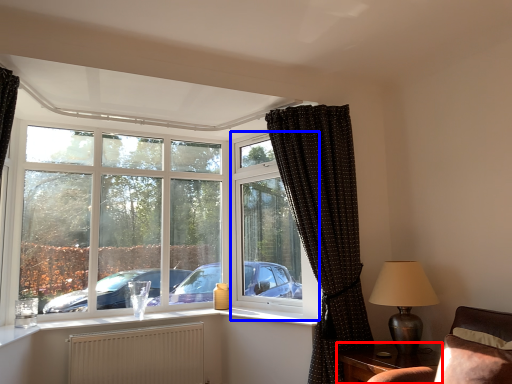
Question: Among these objects, which one is farthest to the camera, table (highlighted by a red box) or window frame (highlighted by a blue box)?

Choices:
 (A) table
 (B) window frame

Answer: (B)